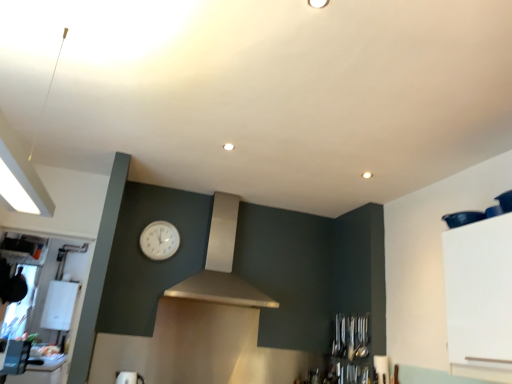
The height and width of the screenshot is (384, 512). What do you see at coordinates (126, 377) in the screenshot? I see `white plastic toaster at lower left, which appears as the first appliance when viewed from the front` at bounding box center [126, 377].

What do you see at coordinates (221, 264) in the screenshot? I see `satin white vent at center` at bounding box center [221, 264].

At what (x,y) coordinates should I click in order to perform the action: click on satin white vent at center. Please return your answer as a coordinate pair (x, y). The image size is (512, 384). Looking at the image, I should click on (221, 264).

At what (x,y) coordinates should I click in order to perform the action: click on white plastic boiler at left, the second appliance in the right-to-left sequence. Please return your answer as a coordinate pair (x, y). This screenshot has height=384, width=512. Looking at the image, I should click on (x=59, y=305).

From the picture: Are white plastic toaster at lower left, the 2th appliance from the back, and satin white vent at center far apart?

Yes.

Is white plastic toaster at lower left, which is the second appliance in left-to-right order, oriented towards satin white vent at center?

No, white plastic toaster at lower left, which is the second appliance in left-to-right order, is not aimed at satin white vent at center.

Would you say white plastic toaster at lower left, arranged as the 1th appliance when viewed from the right, contains satin white vent at center?

No, satin white vent at center is not a part of white plastic toaster at lower left, arranged as the 1th appliance when viewed from the right.

Considering the relative positions of white plastic toaster at lower left, arranged as the 1th appliance when viewed from the right, and satin white vent at center in the image provided, is white plastic toaster at lower left, arranged as the 1th appliance when viewed from the right, to the left or to the right of satin white vent at center?

In the image, white plastic toaster at lower left, arranged as the 1th appliance when viewed from the right, appears on the left side of satin white vent at center.

From the picture: Is white plastic clock at center further to the viewer compared to white plastic toaster at lower left, the 2th appliance from the back?

Yes, white plastic clock at center is further from the camera.

What are the coordinates of `the 1st appliance below the white plastic clock at center (from the image's perspective)` in the screenshot? It's located at (126, 377).

In the scene shown: Is white plastic clock at center to the left of white plastic toaster at lower left, which appears as the first appliance when viewed from the front, from the viewer's perspective?

No, white plastic clock at center is not to the left of white plastic toaster at lower left, which appears as the first appliance when viewed from the front.

How far apart are white plastic boiler at left, the first appliance viewed from the back, and white plastic clock at center?

white plastic boiler at left, the first appliance viewed from the back, and white plastic clock at center are 1.90 meters apart from each other.

Is white plastic boiler at left, which is the 2th appliance in front-to-back order, wider or thinner than white plastic clock at center?

white plastic boiler at left, which is the 2th appliance in front-to-back order, is wider than white plastic clock at center.

Who is smaller, white plastic boiler at left, which is the 2th appliance in front-to-back order, or white plastic clock at center?

Smaller between the two is white plastic clock at center.

Is white plastic boiler at left, the second appliance in the right-to-left sequence, positioned behind white plastic clock at center?

Yes, the depth of white plastic boiler at left, the second appliance in the right-to-left sequence, is greater than that of white plastic clock at center.

Can you tell me how much satin white vent at center and white plastic boiler at left, which is counted as the 1th appliance, starting from the left, differ in facing direction?

0.43 degrees.

Is satin white vent at center touching white plastic boiler at left, the second appliance in the right-to-left sequence?

They are not placed beside each other.

Would you say satin white vent at center contains white plastic boiler at left, which is counted as the 1th appliance, starting from the left?

No, white plastic boiler at left, which is counted as the 1th appliance, starting from the left, is not surrounded by satin white vent at center.

Is white plastic boiler at left, which is the 2th appliance in front-to-back order, surrounding white plastic toaster at lower left, arranged as the 1th appliance when viewed from the right?

No, white plastic toaster at lower left, arranged as the 1th appliance when viewed from the right, is not inside white plastic boiler at left, which is the 2th appliance in front-to-back order.

From a real-world perspective, relative to white plastic toaster at lower left, which appears as the first appliance when viewed from the front, is white plastic boiler at left, the first appliance viewed from the back, vertically above or below?

Clearly, from a real-world perspective, white plastic boiler at left, the first appliance viewed from the back, is above white plastic toaster at lower left, which appears as the first appliance when viewed from the front.

This screenshot has height=384, width=512. I want to click on appliance in front of the white plastic boiler at left, which is the 2th appliance in front-to-back order, so click(126, 377).

Is point (59, 301) farther from viewer compared to point (262, 299)?

Yes, it is behind point (262, 299).

Is white plastic boiler at left, the second appliance in the right-to-left sequence, facing away from satin white vent at center?

No, white plastic boiler at left, the second appliance in the right-to-left sequence, is not facing the opposite direction of satin white vent at center.

How different are the orientations of white plastic boiler at left, which is counted as the 1th appliance, starting from the left, and satin white vent at center in degrees?

The facing directions of white plastic boiler at left, which is counted as the 1th appliance, starting from the left, and satin white vent at center are 0.43 degrees apart.

From a real-world perspective, who is located higher, satin white vent at center or white plastic clock at center?

In real-world perspective, white plastic clock at center is above.

Based on their sizes in the image, would you say satin white vent at center is bigger or smaller than white plastic clock at center?

In the image, satin white vent at center appears to be larger than white plastic clock at center.

Is satin white vent at center wider or thinner than white plastic clock at center?

In the image, satin white vent at center appears to be wider than white plastic clock at center.

You are a GUI agent. You are given a task and a screenshot of the screen. Output one action in this format:
    pyautogui.click(x=<x>, y=<y>)
    Task: Click on the vent above the white plastic toaster at lower left, which appears as the first appliance when viewed from the front (from the image's perspective)
    This screenshot has width=512, height=384.
    Given the screenshot: What is the action you would take?
    point(221,264)

Find the location of a particular element. This screenshot has width=512, height=384. clock above the white plastic toaster at lower left, which appears as the first appliance when viewed from the front (from a real-world perspective) is located at coordinates (159, 240).

Consider the image. Considering their positions, is white plastic clock at center positioned closer to white plastic toaster at lower left, the 2th appliance from the back, than white plastic boiler at left, the first appliance viewed from the back?

Based on the image, white plastic clock at center appears to be nearer to white plastic toaster at lower left, the 2th appliance from the back.

Based on their spatial positions, is white plastic clock at center or white plastic toaster at lower left, the 2th appliance from the back, closer to white plastic boiler at left, the second appliance in the right-to-left sequence?

white plastic clock at center.

Estimate the real-world distances between objects in this image. Which object is further from white plastic clock at center, white plastic boiler at left, the second appliance in the right-to-left sequence, or satin white vent at center?

white plastic boiler at left, the second appliance in the right-to-left sequence, lies further to white plastic clock at center than the other object.

Estimate the real-world distances between objects in this image. Which object is closer to white plastic boiler at left, which is counted as the 1th appliance, starting from the left, satin white vent at center or white plastic toaster at lower left, arranged as the 1th appliance when viewed from the right?

white plastic toaster at lower left, arranged as the 1th appliance when viewed from the right, is closer to white plastic boiler at left, which is counted as the 1th appliance, starting from the left.

Looking at the image, which one is located further to white plastic clock at center, white plastic toaster at lower left, which appears as the first appliance when viewed from the front, or satin white vent at center?

Result: white plastic toaster at lower left, which appears as the first appliance when viewed from the front, is further to white plastic clock at center.

Which object lies further to the anchor point satin white vent at center, white plastic toaster at lower left, which is the second appliance in left-to-right order, or white plastic clock at center?

white plastic toaster at lower left, which is the second appliance in left-to-right order.

When comparing their distances from white plastic boiler at left, which is the 2th appliance in front-to-back order, does white plastic clock at center or satin white vent at center seem further?

satin white vent at center is positioned further to the anchor white plastic boiler at left, which is the 2th appliance in front-to-back order.

From the image, which object appears to be farther from white plastic toaster at lower left, which is the second appliance in left-to-right order, white plastic boiler at left, the first appliance viewed from the back, or white plastic clock at center?

Among the two, white plastic boiler at left, the first appliance viewed from the back, is located further to white plastic toaster at lower left, which is the second appliance in left-to-right order.

Find the location of a particular element. clock located between white plastic toaster at lower left, which appears as the first appliance when viewed from the front, and white plastic boiler at left, the second appliance in the right-to-left sequence, in the depth direction is located at coordinates (159, 240).

Where is `vent positioned between white plastic toaster at lower left, the 2th appliance from the back, and white plastic boiler at left, which is the 2th appliance in front-to-back order, from near to far`? vent positioned between white plastic toaster at lower left, the 2th appliance from the back, and white plastic boiler at left, which is the 2th appliance in front-to-back order, from near to far is located at coordinates (221, 264).

Locate an element on the screen. vent between white plastic clock at center and white plastic toaster at lower left, arranged as the 1th appliance when viewed from the right, in the vertical direction is located at coordinates (221, 264).

This screenshot has height=384, width=512. What are the coordinates of `clock positioned between satin white vent at center and white plastic boiler at left, the first appliance viewed from the back, from near to far` in the screenshot? It's located at (159, 240).